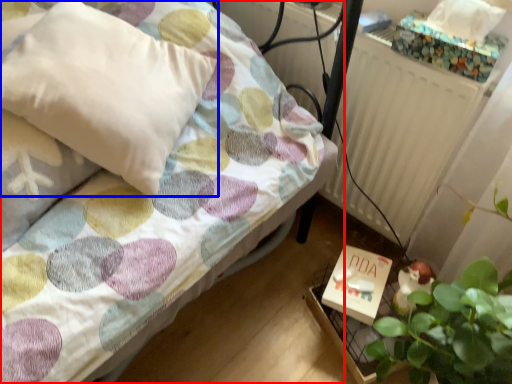
Question: Which object is further to the camera taking this photo, bed (highlighted by a red box) or pillow (highlighted by a blue box)?

Choices:
 (A) bed
 (B) pillow

Answer: (B)